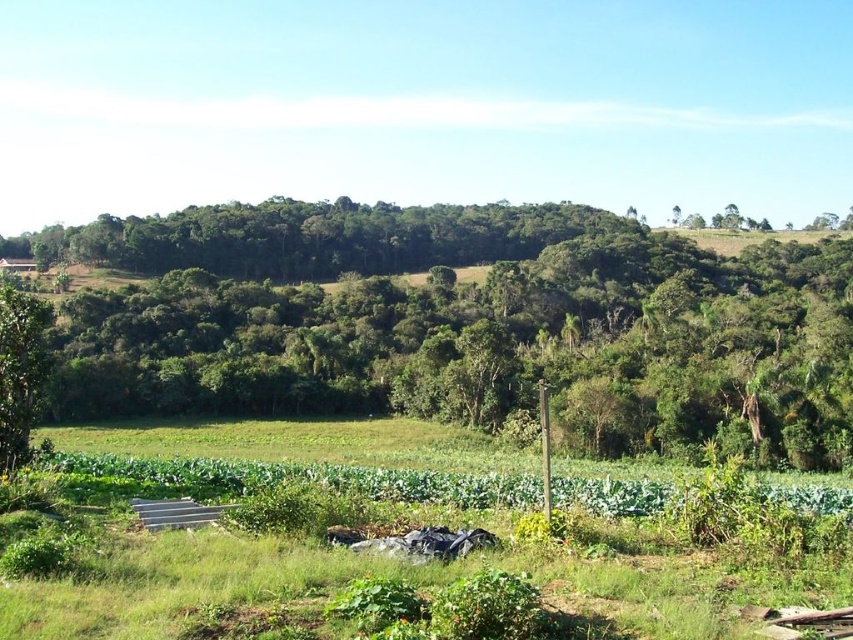
Question: Is green leafy tree at center bigger than green leafy tree at left?

Choices:
 (A) no
 (B) yes

Answer: (B)

Question: Which object appears closest to the camera in this image?

Choices:
 (A) green leafy tree at center
 (B) green leafy tree at left

Answer: (B)

Question: Which of the following is the farthest from the observer?

Choices:
 (A) green leafy tree at left
 (B) green leafy tree at center

Answer: (B)

Question: Is green leafy tree at center further to the viewer compared to green leafy tree at left?

Choices:
 (A) yes
 (B) no

Answer: (A)

Question: Is green leafy tree at center positioned behind green leafy tree at left?

Choices:
 (A) no
 (B) yes

Answer: (B)